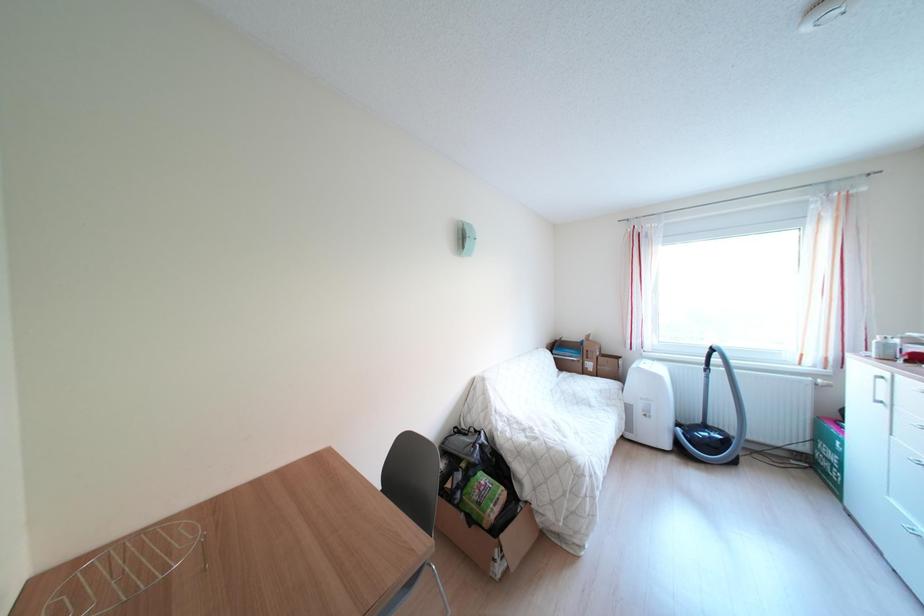
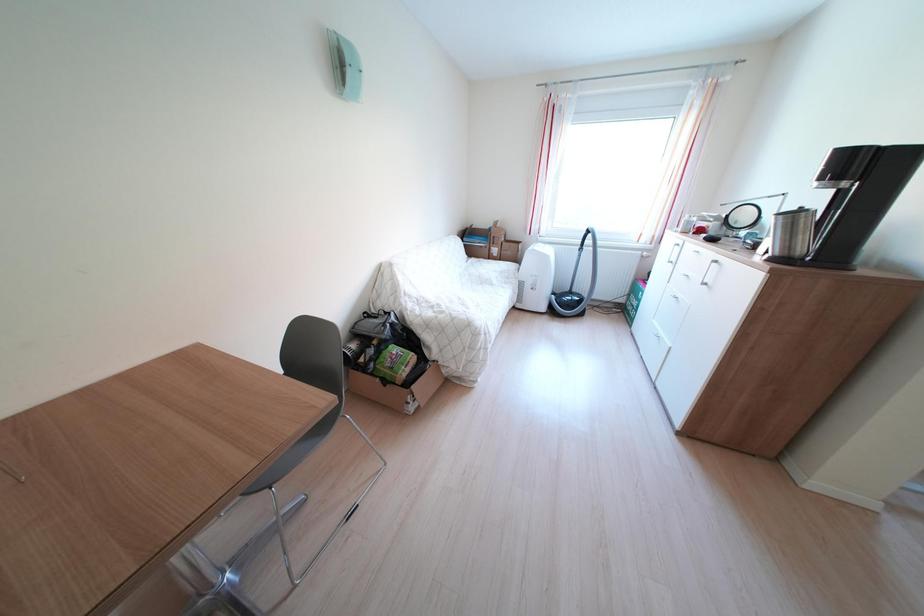
How did the camera likely rotate?

The camera rotated toward right-down.